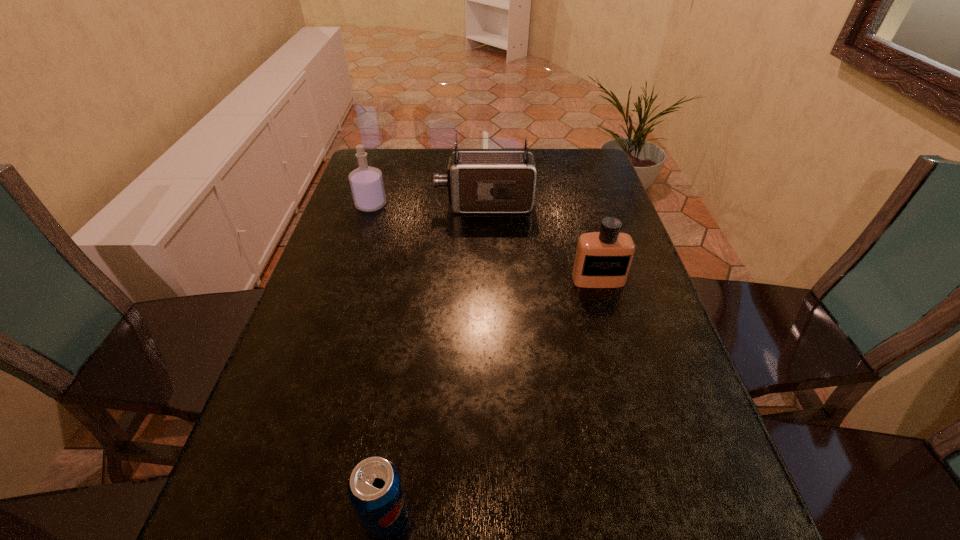
This screenshot has width=960, height=540. I want to click on object that is at the left edge, so click(366, 182).

Identify the location of object situated at the right edge. (603, 259).

Identify the location of vacant region at the far edge of the desktop. This screenshot has height=540, width=960. (418, 150).

In order to click on vacant space at the left edge of the desktop in this screenshot , I will do `click(390, 209)`.

Identify the location of vacant region at the right edge. Image resolution: width=960 pixels, height=540 pixels. (731, 539).

I want to click on vacant space at the far right corner of the desktop, so click(590, 173).

You are a GUI agent. You are given a task and a screenshot of the screen. Output one action in this format:
    pyautogui.click(x=<x>, y=<y>)
    Task: Click on the free point between the leftmost object and the camcorder
    This screenshot has height=540, width=960.
    Given the screenshot: What is the action you would take?
    point(428,205)

Find the location of `free area in between the camcorder and the farther perfume`. free area in between the camcorder and the farther perfume is located at coordinates (428, 205).

I want to click on vacant point located between the left perfume and the camcorder, so click(428, 205).

Identify the location of empty location between the farther perfume and the camcorder. (428, 205).